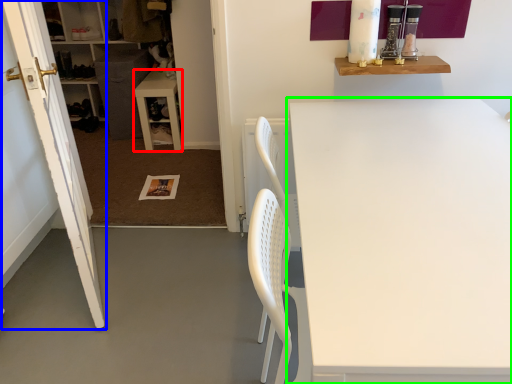
Question: Estimate the real-world distances between objects in this image. Which object is closer to table (highlighted by a red box), door (highlighted by a blue box) or table (highlighted by a green box)?

Choices:
 (A) door
 (B) table

Answer: (A)